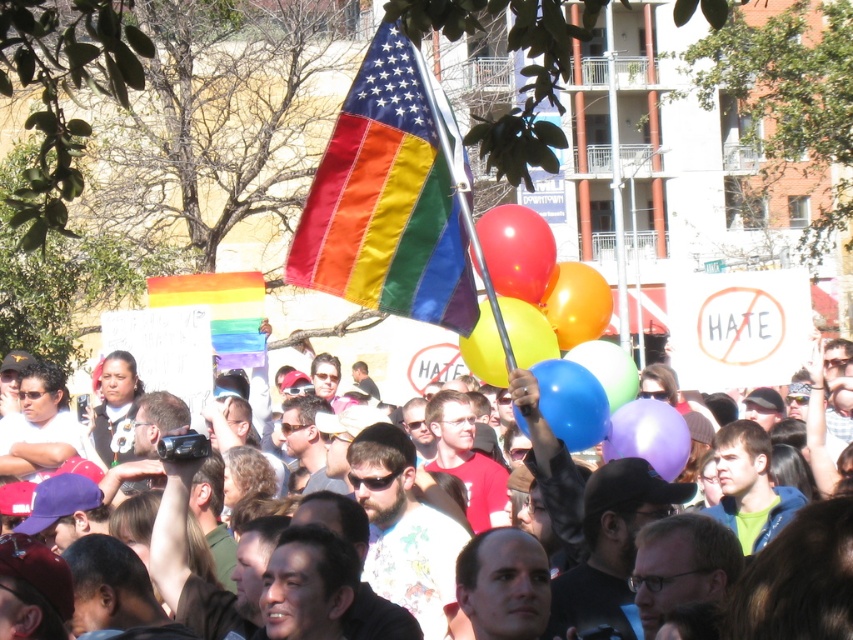
Does satin rainbow flag at center appear over rubber balloon at center?

Yes, satin rainbow flag at center is above rubber balloon at center.

Who is higher up, satin rainbow flag at center or rubber balloon at center?

Positioned higher is satin rainbow flag at center.

Where is `satin rainbow flag at center`? The image size is (853, 640). satin rainbow flag at center is located at coordinates (386, 202).

Is matte rainbow flag at upper center positioned behind translucent multicolored balloons at center?

No, matte rainbow flag at upper center is closer to the viewer.

Is matte rainbow flag at upper center below translucent multicolored balloons at center?

Yes.

In order to click on matte rainbow flag at upper center in this screenshot , I will do `click(813, 616)`.

In the scene shown: Does satin rainbow flag at center have a smaller size compared to purple glossy balloon at center?

No.

Does satin rainbow flag at center lie in front of purple glossy balloon at center?

Yes.

Find the location of a particular element. The width and height of the screenshot is (853, 640). satin rainbow flag at center is located at coordinates (386, 202).